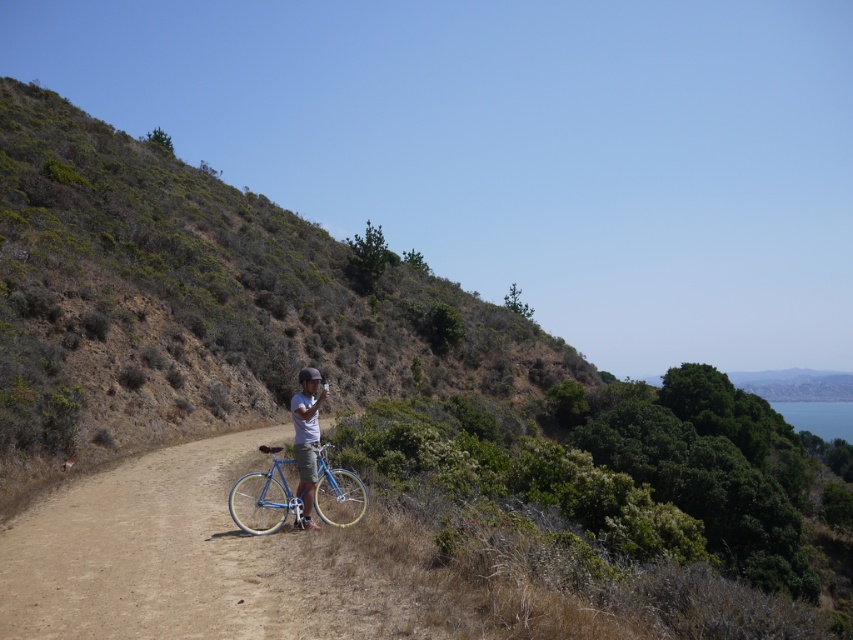
Question: Among these objects, which one is nearest to the camera?

Choices:
 (A) matte blue bicycle at center
 (B) shiny blue frame at center

Answer: (B)

Question: Can you confirm if shiny blue frame at center is smaller than matte blue bicycle at center?

Choices:
 (A) no
 (B) yes

Answer: (A)

Question: Which object appears closest to the camera in this image?

Choices:
 (A) matte blue bicycle at center
 (B) shiny blue frame at center

Answer: (B)

Question: Is shiny blue frame at center smaller than matte blue bicycle at center?

Choices:
 (A) yes
 (B) no

Answer: (B)

Question: Can you confirm if shiny blue frame at center is thinner than matte blue bicycle at center?

Choices:
 (A) no
 (B) yes

Answer: (A)